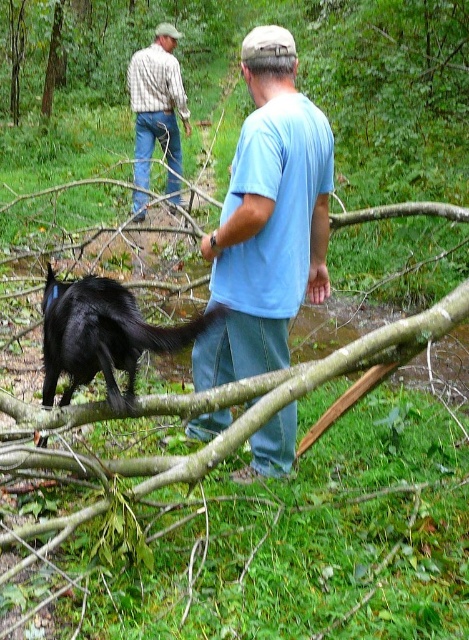
Question: Which object is positioned farthest from the plaid shirt at upper left?

Choices:
 (A) shiny black dog at lower left
 (B) blue cotton shirt at center

Answer: (A)

Question: Is the position of blue cotton shirt at center less distant than that of plaid shirt at upper left?

Choices:
 (A) no
 (B) yes

Answer: (B)

Question: Is shiny black dog at lower left positioned at the back of plaid shirt at upper left?

Choices:
 (A) no
 (B) yes

Answer: (A)

Question: Does blue cotton shirt at center appear over shiny black dog at lower left?

Choices:
 (A) yes
 (B) no

Answer: (A)

Question: Which point is closer to the camera taking this photo?

Choices:
 (A) (257, 44)
 (B) (121, 304)
 (C) (167, 97)

Answer: (B)

Question: Which is nearer to the blue cotton shirt at center?

Choices:
 (A) shiny black dog at lower left
 (B) plaid shirt at upper left

Answer: (A)